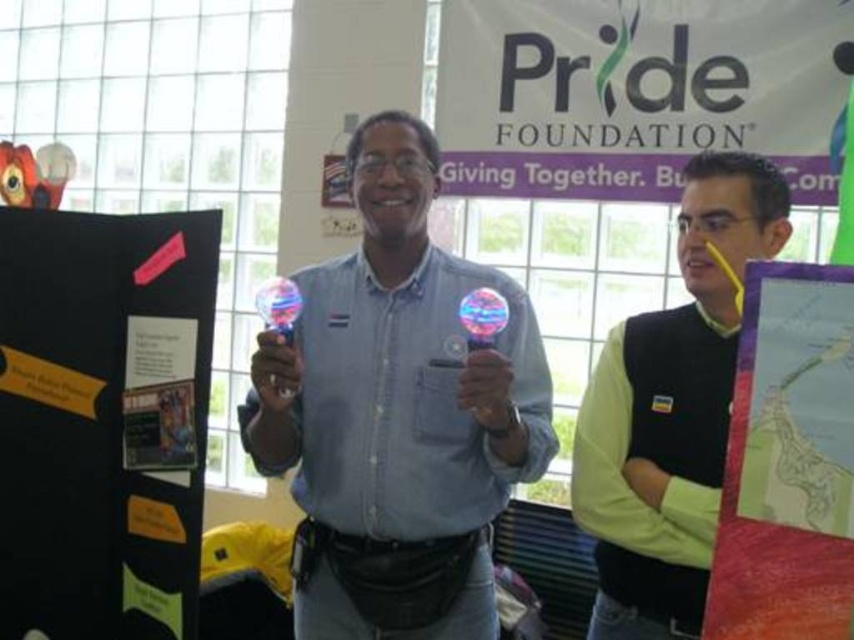
You are at a Pride Foundation event and need to hang a banner that requires two people to lift it. The banner is too heavy for one person. You see the blue fabric shirt at center and the green matte vest at center. Which person should you ask for help based on their height?

The blue fabric shirt at center is taller than the green matte vest at center, so you should ask the person wearing the blue fabric shirt at center for help because they are taller and may be able to reach higher when lifting the banner.

What are the coordinates of the blue fabric shirt at center?

The blue fabric shirt at center is located at point (396, 413).